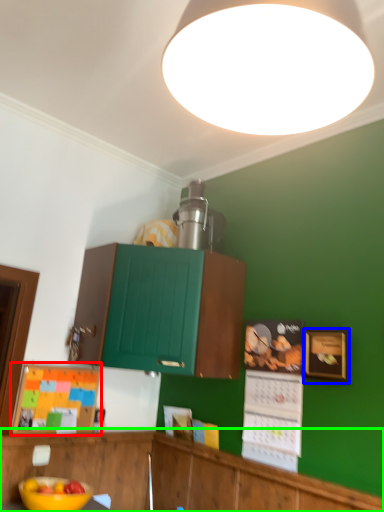
Question: Which is farther away from bulletin board (highlighted by a red box)? picture frame (highlighted by a blue box) or cabinetry (highlighted by a green box)?

Choices:
 (A) picture frame
 (B) cabinetry

Answer: (A)